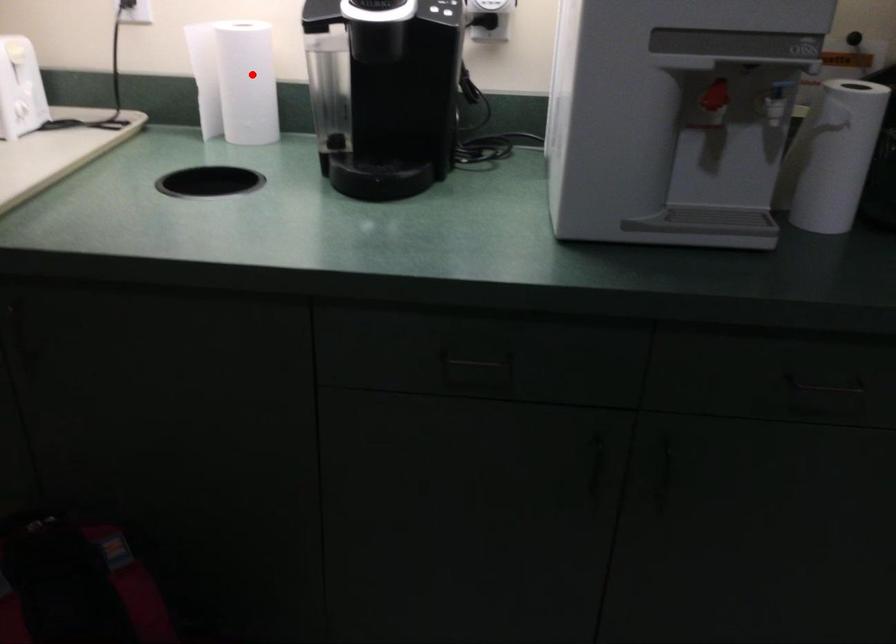
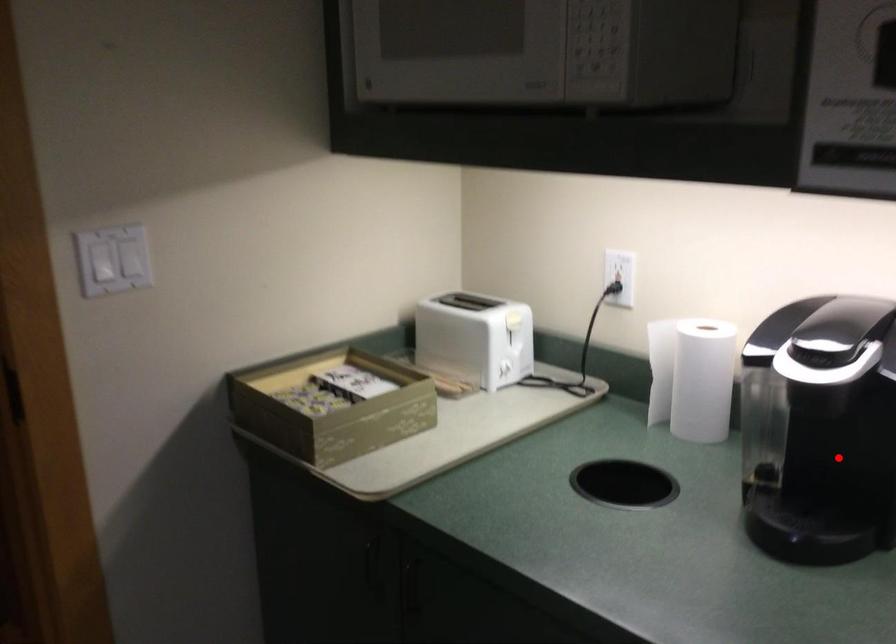
I am providing you with two images of the same scene from different viewpoints. A red point is marked on the first image and another point is marked on the second image. Is the marked point in image1 the same physical position as the marked point in image2?

A: No